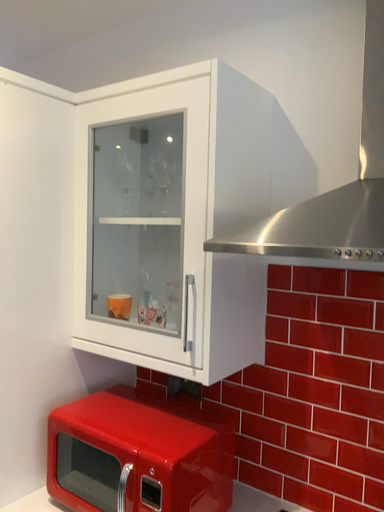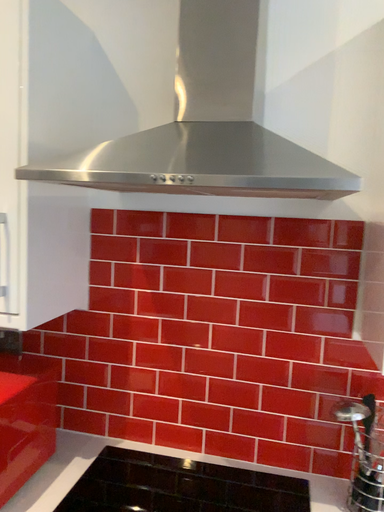
Question: How did the camera likely rotate when shooting the video?

Choices:
 (A) rotated right
 (B) rotated left

Answer: (A)